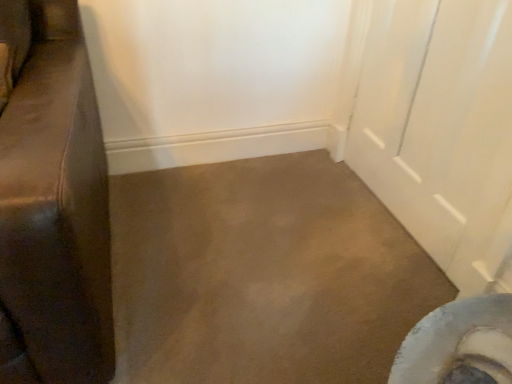
Where is `brown carpet at center`? brown carpet at center is located at coordinates (262, 275).

The width and height of the screenshot is (512, 384). What do you see at coordinates (262, 275) in the screenshot?
I see `brown carpet at center` at bounding box center [262, 275].

At what (x,y) coordinates should I click in order to perform the action: click on brown carpet at center. Please return your answer as a coordinate pair (x, y). This screenshot has height=384, width=512. Looking at the image, I should click on (262, 275).